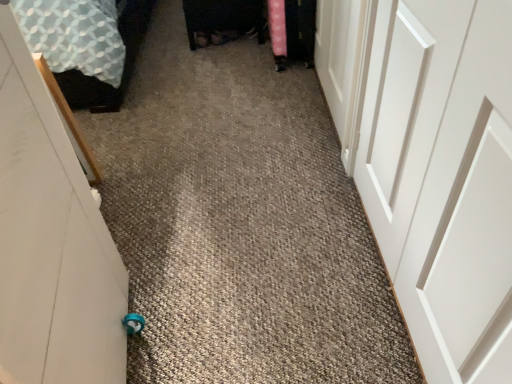
Describe the element at coordinates (51, 242) in the screenshot. I see `white matte door at left, marked as the 3th door in a right-to-left arrangement` at that location.

What is the approximate height of white matte door at upper right, positioned as the 2th door in right-to-left order?

It is 26.78 inches.

Describe the element at coordinates (124, 63) in the screenshot. The width and height of the screenshot is (512, 384). I see `patterned fabric bed at left` at that location.

Where is `white matte door at left, placed as the first door when sorted from left to right`? The height and width of the screenshot is (384, 512). white matte door at left, placed as the first door when sorted from left to right is located at coordinates (51, 242).

From the image's perspective, which one is positioned higher, patterned fabric bed at left or white smooth door at right, which is counted as the first door, starting from the right?

patterned fabric bed at left.

Is patterned fabric bed at left positioned with its back to white smooth door at right, which is counted as the first door, starting from the right?

No, patterned fabric bed at left is not facing away from white smooth door at right, which is counted as the first door, starting from the right.

Considering the sizes of objects patterned fabric bed at left and white smooth door at right, the third door viewed from the left, in the image provided, who is smaller, patterned fabric bed at left or white smooth door at right, the third door viewed from the left,?

With smaller size is white smooth door at right, the third door viewed from the left.

You are a GUI agent. You are given a task and a screenshot of the screen. Output one action in this format:
    pyautogui.click(x=<x>, y=<y>)
    Task: Click on the 2nd door below the patterned fabric bed at left (from the image's perspective)
    
    Given the screenshot: What is the action you would take?
    pyautogui.click(x=443, y=178)

Can you confirm if white matte door at left, placed as the first door when sorted from left to right, is shorter than white smooth door at right, the third door viewed from the left?

No.

From a real-world perspective, is white matte door at left, marked as the 3th door in a right-to-left arrangement, located higher than white smooth door at right, the third door viewed from the left?

Yes, from a real-world perspective, white matte door at left, marked as the 3th door in a right-to-left arrangement, is on top of white smooth door at right, the third door viewed from the left.

Is white matte door at left, marked as the 3th door in a right-to-left arrangement, closer to the viewer compared to white smooth door at right, which is counted as the first door, starting from the right?

Yes, white matte door at left, marked as the 3th door in a right-to-left arrangement, is closer to the camera.

Does point (62, 233) come behind point (478, 31)?

Yes, point (62, 233) is farther from viewer.

Does white matte door at left, placed as the first door when sorted from left to right, have a lesser height compared to patterned fabric bed at left?

No, white matte door at left, placed as the first door when sorted from left to right, is not shorter than patterned fabric bed at left.

The width and height of the screenshot is (512, 384). I want to click on the 1st door counting from the right of the patterned fabric bed at left, so click(x=51, y=242).

Considering the relative sizes of white matte door at left, marked as the 3th door in a right-to-left arrangement, and patterned fabric bed at left in the image provided, is white matte door at left, marked as the 3th door in a right-to-left arrangement, wider than patterned fabric bed at left?

No, white matte door at left, marked as the 3th door in a right-to-left arrangement, is not wider than patterned fabric bed at left.

From the image's perspective, starting from the patterned fabric bed at left, which door is the 3rd one below? Please provide its 2D coordinates.

[(51, 242)]

Considering the relative positions of patterned fabric bed at left and white matte door at left, placed as the first door when sorted from left to right, in the image provided, is patterned fabric bed at left to the right of white matte door at left, placed as the first door when sorted from left to right, from the viewer's perspective?

No.

Considering the relative sizes of patterned fabric bed at left and white matte door at left, marked as the 3th door in a right-to-left arrangement, in the image provided, is patterned fabric bed at left shorter than white matte door at left, marked as the 3th door in a right-to-left arrangement,?

Indeed, patterned fabric bed at left has a lesser height compared to white matte door at left, marked as the 3th door in a right-to-left arrangement.

Would you consider white smooth door at right, the third door viewed from the left, to be distant from patterned fabric bed at left?

Absolutely, white smooth door at right, the third door viewed from the left, is distant from patterned fabric bed at left.

Measure the distance from white smooth door at right, which is counted as the first door, starting from the right, to patterned fabric bed at left.

white smooth door at right, which is counted as the first door, starting from the right, is 5.70 feet away from patterned fabric bed at left.

From the image's perspective, is white smooth door at right, which is counted as the first door, starting from the right, located above or below patterned fabric bed at left?

white smooth door at right, which is counted as the first door, starting from the right, is below patterned fabric bed at left.

Is the depth of white smooth door at right, which is counted as the first door, starting from the right, greater than that of patterned fabric bed at left?

No, white smooth door at right, which is counted as the first door, starting from the right, is closer to the viewer.

Which object is further away from the camera, white matte door at upper right, positioned as the 2th door in right-to-left order, or white smooth door at right, the third door viewed from the left?

Positioned behind is white matte door at upper right, positioned as the 2th door in right-to-left order.

Which object is positioned more to the right, white matte door at upper right, arranged as the 2th door when viewed from the left, or white smooth door at right, which is counted as the first door, starting from the right?

From the viewer's perspective, white smooth door at right, which is counted as the first door, starting from the right, appears more on the right side.

Identify the location of door that is the 1st object located in front of the white matte door at upper right, arranged as the 2th door when viewed from the left. (443, 178).

Based on the photo, can we say white matte door at upper right, positioned as the 2th door in right-to-left order, lies outside white smooth door at right, which is counted as the first door, starting from the right?

Absolutely, white matte door at upper right, positioned as the 2th door in right-to-left order, is external to white smooth door at right, which is counted as the first door, starting from the right.

Is white matte door at upper right, positioned as the 2th door in right-to-left order, inside or outside of white matte door at left, placed as the first door when sorted from left to right?

white matte door at upper right, positioned as the 2th door in right-to-left order, cannot be found inside white matte door at left, placed as the first door when sorted from left to right.

Based on the photo, which of these two, white matte door at upper right, arranged as the 2th door when viewed from the left, or white matte door at left, placed as the first door when sorted from left to right, is wider?

white matte door at left, placed as the first door when sorted from left to right, is wider.

Find the location of a particular element. door that is the 2nd object located in front of the white matte door at upper right, arranged as the 2th door when viewed from the left is located at coordinates (51, 242).

Locate an element on the screen. door that is the 3rd object to the right of the patterned fabric bed at left, starting at the anchor is located at coordinates (443, 178).

The width and height of the screenshot is (512, 384). What are the coordinates of `door that is the 1st object located above the white matte door at left, placed as the first door when sorted from left to right (from the image's perspective)` in the screenshot? It's located at (443, 178).

Consider the image. Which object lies further to the anchor point white matte door at upper right, arranged as the 2th door when viewed from the left, white matte door at left, placed as the first door when sorted from left to right, or patterned fabric bed at left?

patterned fabric bed at left is positioned further to the anchor white matte door at upper right, arranged as the 2th door when viewed from the left.

Estimate the real-world distances between objects in this image. Which object is closer to white smooth door at right, the third door viewed from the left, white matte door at upper right, arranged as the 2th door when viewed from the left, or white matte door at left, placed as the first door when sorted from left to right?

white matte door at upper right, arranged as the 2th door when viewed from the left, lies closer to white smooth door at right, the third door viewed from the left, than the other object.

Considering their positions, is white matte door at left, marked as the 3th door in a right-to-left arrangement, positioned further to white smooth door at right, which is counted as the first door, starting from the right, than white matte door at upper right, positioned as the 2th door in right-to-left order?

white matte door at left, marked as the 3th door in a right-to-left arrangement.

Which object lies further to the anchor point patterned fabric bed at left, white smooth door at right, the third door viewed from the left, or white matte door at upper right, arranged as the 2th door when viewed from the left?

white smooth door at right, the third door viewed from the left, lies further to patterned fabric bed at left than the other object.

From the image, which object appears to be farther from white smooth door at right, which is counted as the first door, starting from the right, white matte door at left, marked as the 3th door in a right-to-left arrangement, or patterned fabric bed at left?

Based on the image, patterned fabric bed at left appears to be further to white smooth door at right, which is counted as the first door, starting from the right.

Considering their positions, is white matte door at left, placed as the first door when sorted from left to right, positioned closer to patterned fabric bed at left than white matte door at upper right, arranged as the 2th door when viewed from the left?

white matte door at upper right, arranged as the 2th door when viewed from the left.

Estimate the real-world distances between objects in this image. Which object is further from white matte door at upper right, arranged as the 2th door when viewed from the left, white smooth door at right, the third door viewed from the left, or white matte door at left, placed as the first door when sorted from left to right?

white matte door at left, placed as the first door when sorted from left to right.

Based on the photo, when comparing their distances from patterned fabric bed at left, does white matte door at upper right, positioned as the 2th door in right-to-left order, or white matte door at left, marked as the 3th door in a right-to-left arrangement, seem closer?

Based on the image, white matte door at upper right, positioned as the 2th door in right-to-left order, appears to be nearer to patterned fabric bed at left.

Where is `door located between white matte door at left, placed as the first door when sorted from left to right, and white matte door at upper right, arranged as the 2th door when viewed from the left, in the depth direction`? This screenshot has width=512, height=384. door located between white matte door at left, placed as the first door when sorted from left to right, and white matte door at upper right, arranged as the 2th door when viewed from the left, in the depth direction is located at coordinates (443, 178).

Find the location of a particular element. This screenshot has height=384, width=512. door between patterned fabric bed at left and white matte door at upper right, positioned as the 2th door in right-to-left order, in the horizontal direction is located at coordinates (51, 242).